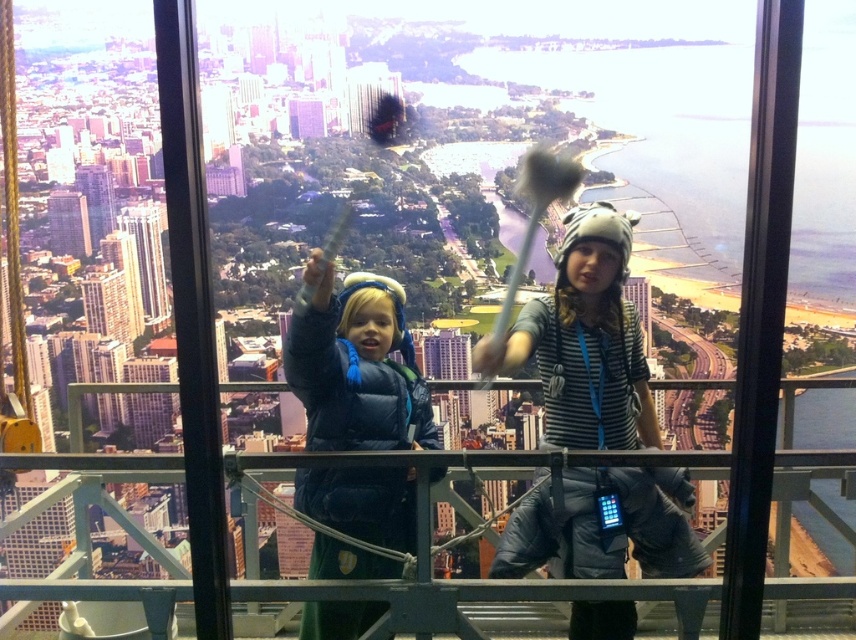
You are a drone operator who needs to fly a drone between the matte gray building at left and the smooth glass skyscraper at center. The drone has a maximum flight range of 40 meters. Can the drone safely complete this task without exceeding its range?

The distance between the matte gray building at left and the smooth glass skyscraper at center is 42.85 meters, which exceeds the drone operator drone maximum flight range of 40 meters. Therefore, the drone cannot safely complete the task without exceeding its range.

You are a window cleaner standing on the observation deck. You need to clean the windows of the matte gray building at left and the smooth glass skyscraper at center. Which building should you clean first if you want to start from the lower elevation?

The matte gray building at left should be cleaned first because it is located below the smooth glass skyscraper at center, making it the lower elevation.